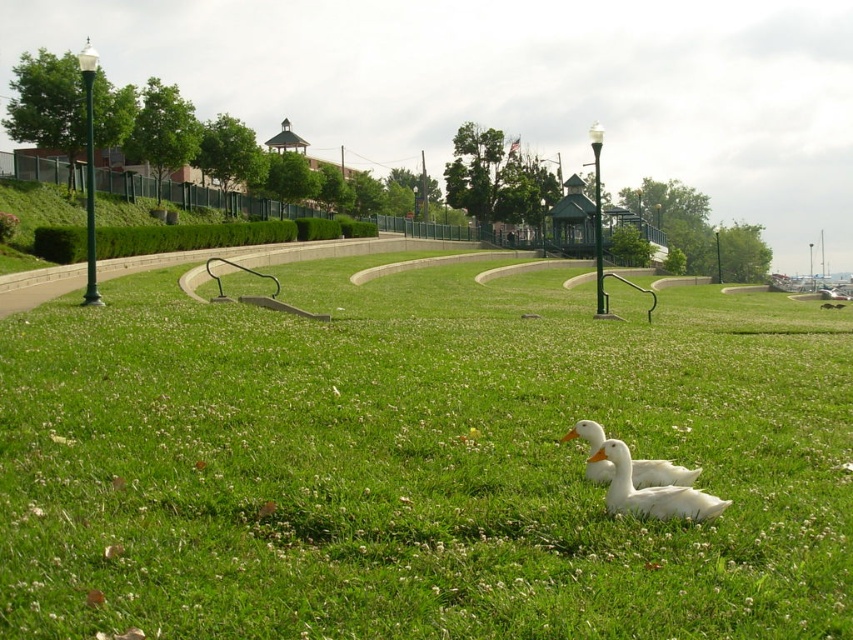
You are standing at the center of the park and see the point marked at coordinates (651, 492). What object is located at that point?

The point at coordinates (651, 492) indicates the location of the white matte duck at lower right.

You are standing in the park and want to walk from point (277, 419) to point (608, 476). Which direction should you turn to face the correct path?

You should turn to face the direction towards point (608, 476), which is further away from you compared to point (277, 419). Since point (277, 419) is closer to you, you need to move away from your current position towards the point that is further back in the scene.

You are standing in the park and want to take a photo of the green grassy at center and white matte duck at center. Which object should you focus on first if you want to capture both in the same frame without moving your camera?

You should focus on the green grassy at center first because it is to the left of the white matte duck at center, so positioning the camera to include both would require framing from the left side where the grassy area is located.